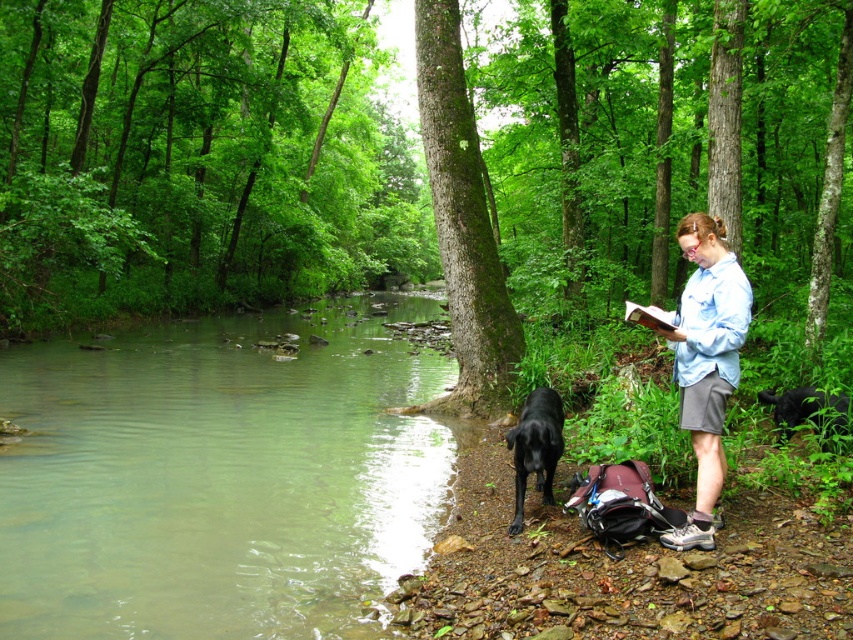
You are a hiker who wants to throw a stone into the green translucent water at center. The black furry dog at lower right is your pet. Can your dog reach the water before the stone if you throw it at 10 meters per second?

The distance between the green translucent water at center and the black furry dog at lower right is 7.74 meters. If you throw the stone at 10 meters per second, it will take approximately 0.77 seconds to reach the water. The dog would need to cover 7.74 meters in that time, which is highly unlikely as the average running speed of a dog is around 15 km per hour, which is about 4.17 meters per second. Therefore, the dog cannot reach the water before the stone.

You are a hiker who wants to cross the stream. You see the green translucent water at center and the black furry dog at lower right. Which object is higher in elevation?

The green translucent water at center is above the black furry dog at lower right, so the green translucent water at center is higher in elevation.

You are a photographer trying to capture a photo of the light blue shirt at center and the black furry dog at lower right in the same frame. The camera you are using has a maximum focus range of 3 meters. Can you fit both subjects in the frame without moving your position?

The light blue shirt at center is 2.97 meters from the black furry dog at lower right, so yes, both subjects can be captured in the same frame since the distance between them is within the camera maximum focus range of 3 meters.